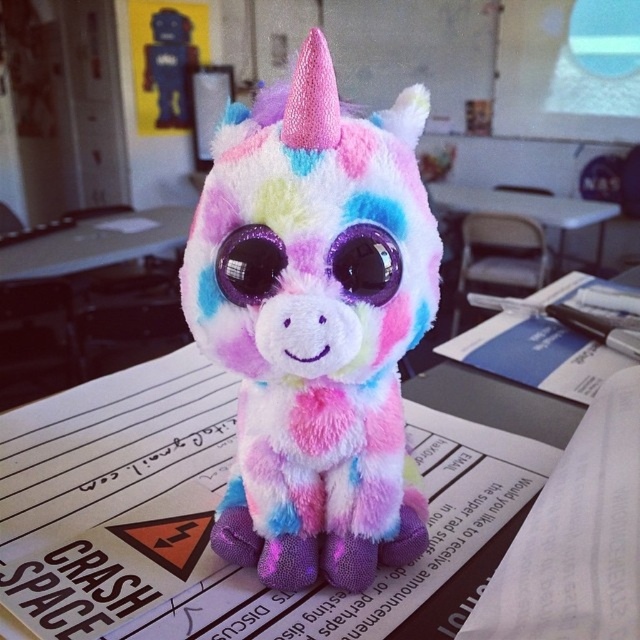
You are standing in a classroom and see the point marked at coordinates (129, 378). If you want to place a 1.2 meter long ruler on the desk so that one end touches this point, will the ruler extend beyond the desk?

The point at coordinates (129, 378) is 1.13 meters away from the viewer. Since the ruler is 1.2 meters long, placing it so one end touches the point would mean the other end extends 0.07 meters beyond the desk.

You are organizing a classroom and need to place a new poster on the wall behind the white plastic table at center. The poster is 1 meter tall. Considering the fluffy rainbow unicorn at center is below the table, will the poster cover the unicorn when hung?

The fluffy rainbow unicorn at center is located below the white plastic table at center, so hanging the poster behind the table will not cover the unicorn since it is positioned below the table.